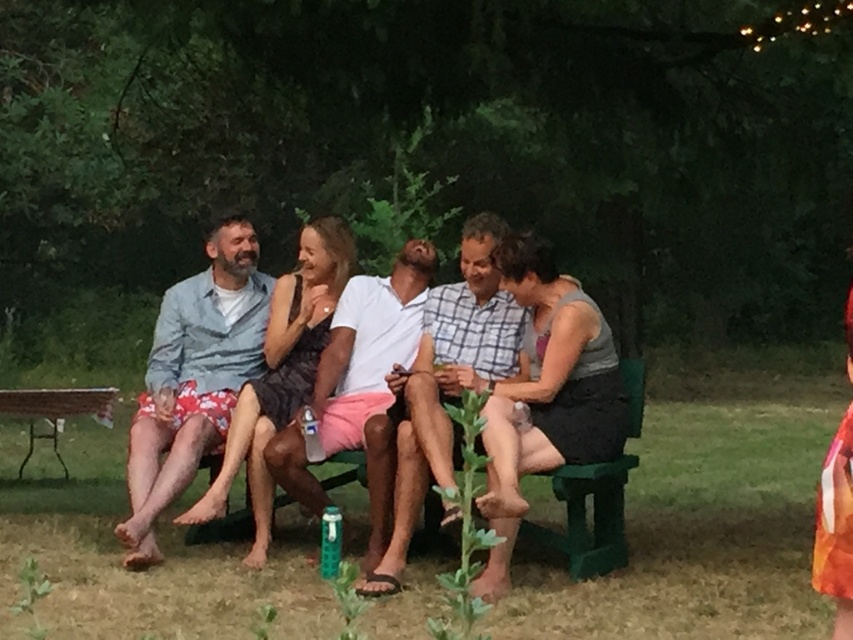
Between point (595, 412) and point (67, 388), which one is positioned in front?

Point (595, 412)

Identify the location of matte white shirt at center. Image resolution: width=853 pixels, height=640 pixels. (505, 381).

Is point (521, 236) positioned in front of point (57, 452)?

Yes, point (521, 236) is closer to viewer.

You are a GUI agent. You are given a task and a screenshot of the screen. Output one action in this format:
    pyautogui.click(x=<x>, y=<y>)
    Task: Click on the matte white shirt at center
    This screenshot has width=853, height=640.
    Given the screenshot: What is the action you would take?
    pyautogui.click(x=505, y=381)

How far apart are light blue denim shirt at left and green plastic picnic table at lower left?

The distance of light blue denim shirt at left from green plastic picnic table at lower left is 1.38 meters.

Does light blue denim shirt at left have a greater height compared to green plastic picnic table at lower left?

Yes, light blue denim shirt at left is taller than green plastic picnic table at lower left.

Who is more forward, [244,232] or [105,413]?

Point [244,232] is more forward.

At what (x,y) coordinates should I click in order to perform the action: click on light blue denim shirt at left. Please return your answer as a coordinate pair (x, y). Image resolution: width=853 pixels, height=640 pixels. Looking at the image, I should click on (193, 378).

From the picture: Can you confirm if light blue denim shirt at left is smaller than white cotton shirt at center?

No, light blue denim shirt at left is not smaller than white cotton shirt at center.

Who is higher up, light blue denim shirt at left or white cotton shirt at center?

Positioned higher is white cotton shirt at center.

Is point (136, 524) closer to viewer compared to point (318, 404)?

Yes.

Where is `light blue denim shirt at left`? light blue denim shirt at left is located at coordinates (193, 378).